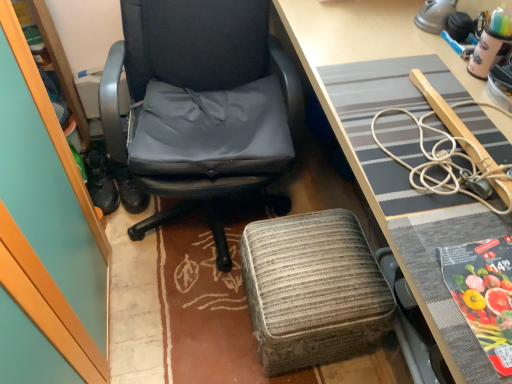
I want to click on free space above woven fabric stool at lower center (from a real-world perspective), so click(310, 263).